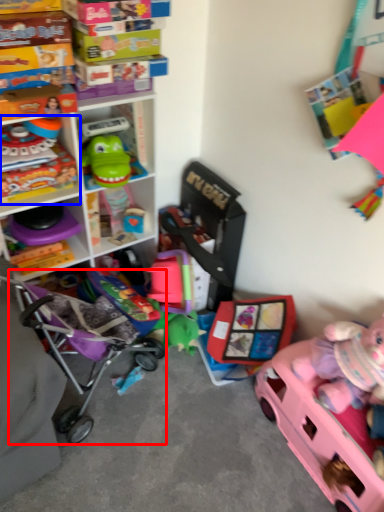
Question: Which point is closer to the camera, baby carriage (highlighted by a red box) or toy (highlighted by a blue box)?

Choices:
 (A) baby carriage
 (B) toy

Answer: (A)